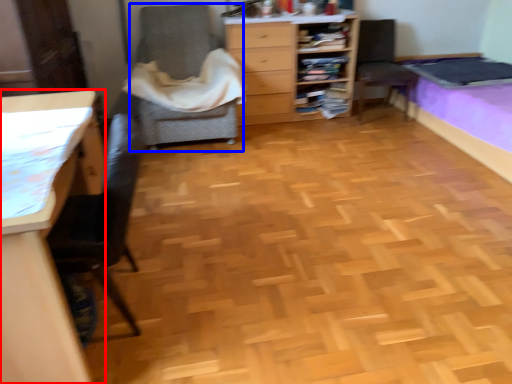
Question: Which object is closer to the camera taking this photo, desk (highlighted by a red box) or chair (highlighted by a blue box)?

Choices:
 (A) desk
 (B) chair

Answer: (A)